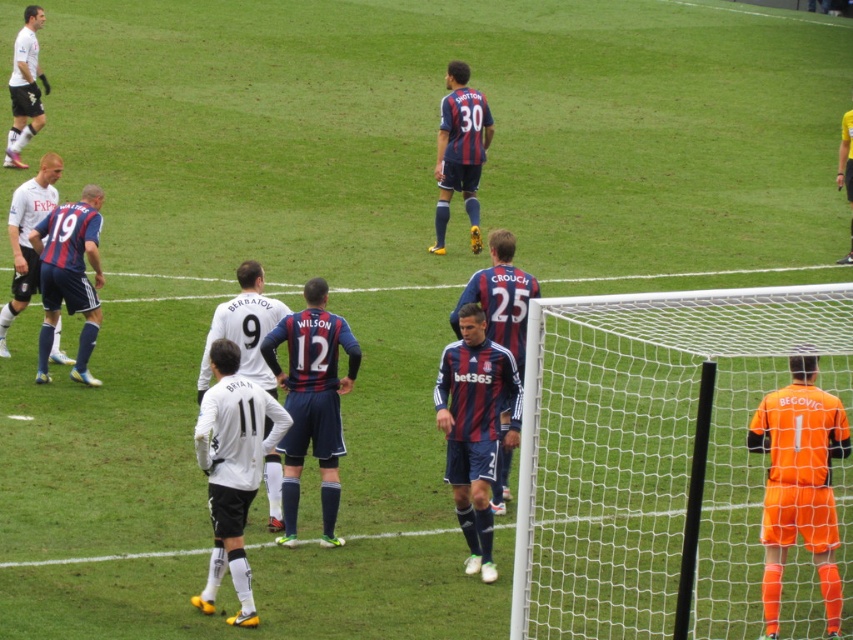
Which is above, striped jersey soccer player at center or matte blue soccer jersey at center?

Positioned higher is matte blue soccer jersey at center.

Between point (488, 577) and point (445, 221), which one is positioned behind?

The point (445, 221) is behind.

I want to click on striped jersey soccer player at center, so click(474, 428).

Does orange matte net at right have a greater width compared to white jersey at upper left?

No.

Can you confirm if orange matte net at right is positioned to the right of white jersey at upper left?

Indeed, orange matte net at right is positioned on the right side of white jersey at upper left.

Who is more distant from viewer, (692, 600) or (44, 77)?

The point (44, 77) is more distant.

Identify the location of orange matte net at right. (654, 454).

Which is above, blue striped jersey at center or white jersey at center?

Positioned higher is blue striped jersey at center.

Does blue striped jersey at center have a lesser width compared to white jersey at center?

Incorrect, blue striped jersey at center's width is not less than white jersey at center's.

Find the location of a particular element. This screenshot has height=640, width=853. blue striped jersey at center is located at coordinates (68, 276).